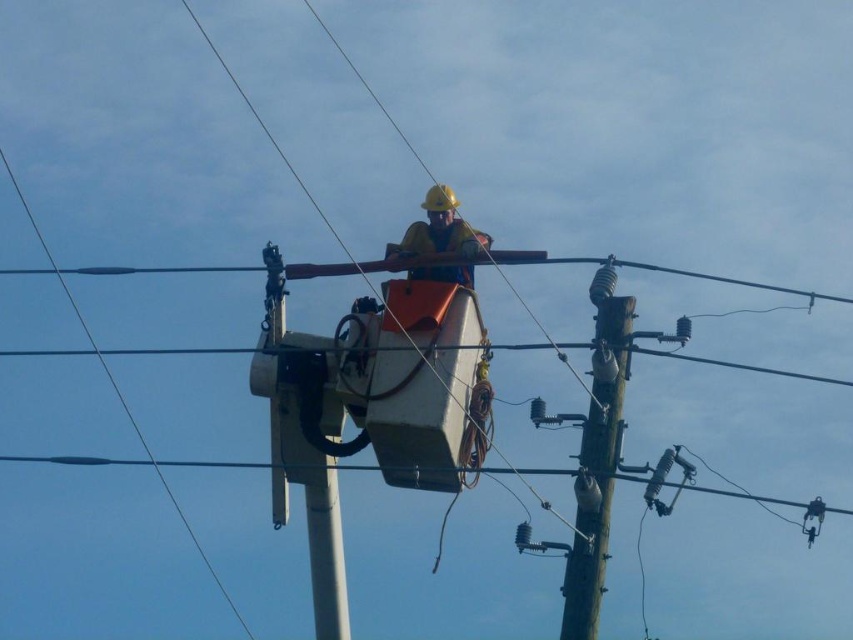
Question: Which point appears closest to the camera in this image?

Choices:
 (A) (409, 228)
 (B) (625, 374)

Answer: (B)

Question: Is wooden telegraph pole at center to the left of yellow hard hat at center from the viewer's perspective?

Choices:
 (A) no
 (B) yes

Answer: (A)

Question: Can you confirm if wooden telegraph pole at center is smaller than yellow hard hat at center?

Choices:
 (A) no
 (B) yes

Answer: (A)

Question: Which of the following is the closest to the observer?

Choices:
 (A) click(x=602, y=429)
 (B) click(x=459, y=218)

Answer: (A)

Question: Does wooden telegraph pole at center appear over yellow hard hat at center?

Choices:
 (A) yes
 (B) no

Answer: (B)

Question: Among these objects, which one is farthest from the camera?

Choices:
 (A) yellow hard hat at center
 (B) wooden telegraph pole at center

Answer: (A)